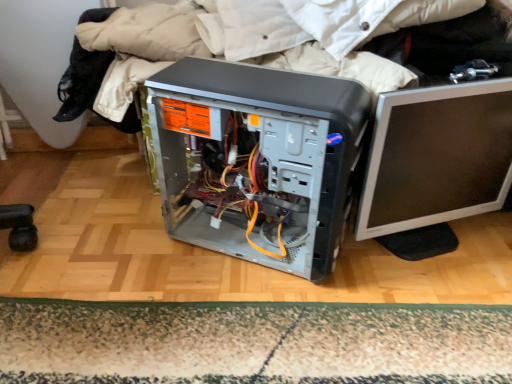
The image size is (512, 384). I want to click on vacant space in front of satin black computer tower at center, so click(257, 325).